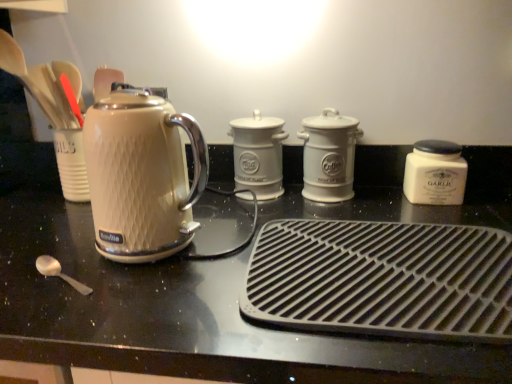
Find the location of a particular element. vacant area situated to the left side of matte cream kettle at left is located at coordinates (49, 246).